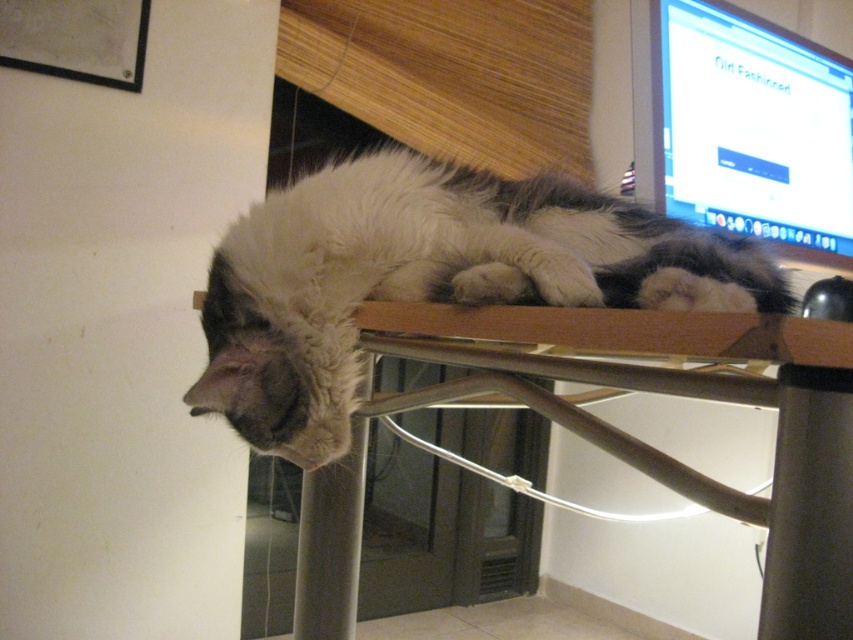
Does wooden at upper center have a lesser height compared to matte plastic monitor at upper right?

Yes, wooden at upper center is shorter than matte plastic monitor at upper right.

From the picture: Who is more forward, (x=785, y=394) or (x=656, y=77)?

Point (x=785, y=394)

I want to click on wooden at upper center, so click(679, 396).

How distant is white fluffy cat at center from matte plastic monitor at upper right?

white fluffy cat at center and matte plastic monitor at upper right are 56.84 centimeters apart.

Who is positioned more to the right, white fluffy cat at center or matte plastic monitor at upper right?

matte plastic monitor at upper right

In the scene shown: Who is more forward, (242, 397) or (822, 157)?

Point (242, 397) is more forward.

The image size is (853, 640). In order to click on white fluffy cat at center in this screenshot , I will do `click(428, 278)`.

Is the position of white fluffy cat at center less distant than that of wooden at upper center?

No.

Where is `white fluffy cat at center`? white fluffy cat at center is located at coordinates (428, 278).